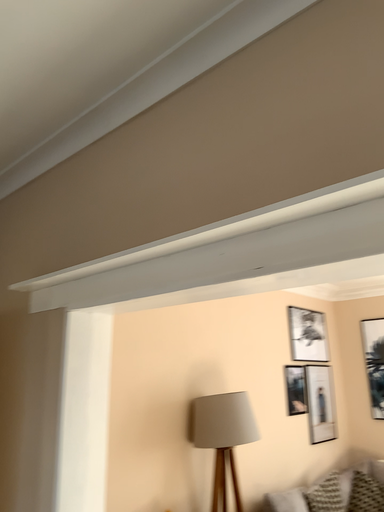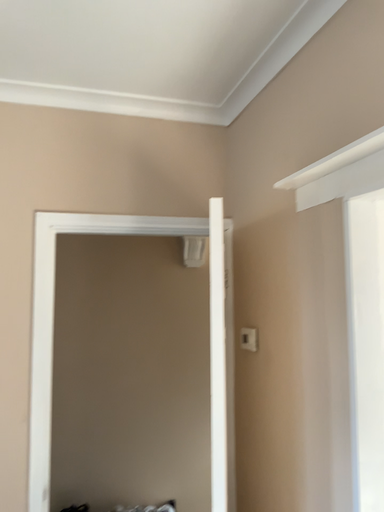
Question: How did the camera likely rotate when shooting the video?

Choices:
 (A) rotated right
 (B) rotated left

Answer: (B)